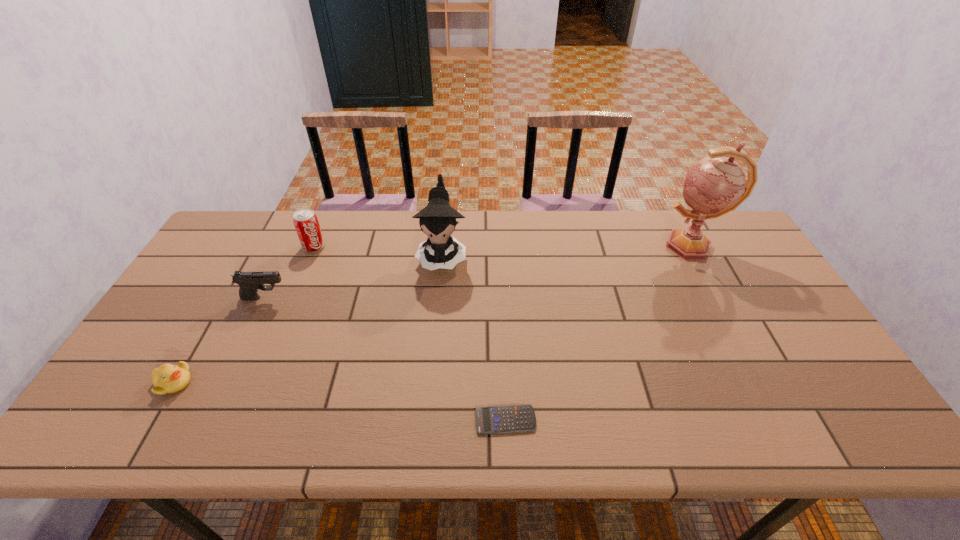
The width and height of the screenshot is (960, 540). Find the location of `vacant space that's between the leftmost object and the fourth farthest object`. vacant space that's between the leftmost object and the fourth farthest object is located at coordinates (219, 340).

At what (x,y) coordinates should I click in order to perform the action: click on vacant area that lies between the leftmost object and the pistol. Please return your answer as a coordinate pair (x, y). The width and height of the screenshot is (960, 540). Looking at the image, I should click on (219, 340).

This screenshot has width=960, height=540. Identify the location of vacant area that lies between the duckling and the globe. (432, 314).

Find the location of a particular element. This screenshot has height=540, width=960. object that is the closest to the third tallest object is located at coordinates (249, 282).

The height and width of the screenshot is (540, 960). Identify the location of object that is the third closest to the globe. (306, 223).

Locate an element on the screen. The height and width of the screenshot is (540, 960). vacant area in the image that satisfies the following two spatial constraints: 1. at the face of the doll; 2. at the barrel of the pistol is located at coordinates (438, 298).

At what (x,y) coordinates should I click in order to perform the action: click on free space that satisfies the following two spatial constraints: 1. at the face of the fourth object from left to right; 2. at the barrel of the fourth farthest object. Please return your answer as a coordinate pair (x, y). This screenshot has width=960, height=540. Looking at the image, I should click on (438, 298).

Where is `vacant space that satisfies the following two spatial constraints: 1. at the face of the fifth shortest object; 2. at the face of the fifth tallest object`? The width and height of the screenshot is (960, 540). vacant space that satisfies the following two spatial constraints: 1. at the face of the fifth shortest object; 2. at the face of the fifth tallest object is located at coordinates (430, 382).

Image resolution: width=960 pixels, height=540 pixels. Identify the location of blank space that satisfies the following two spatial constraints: 1. at the face of the duckling; 2. on the right side of the fifth object from left to right. (152, 420).